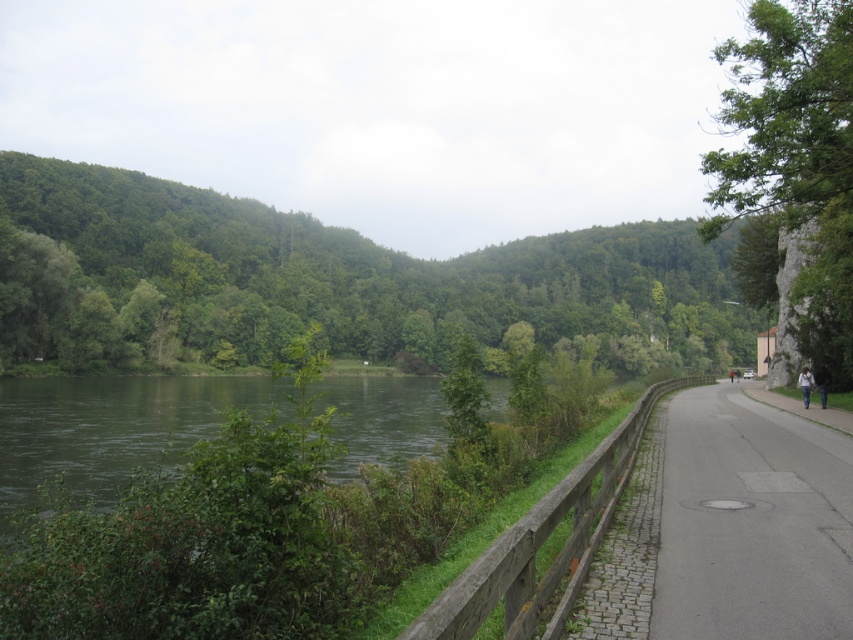
Can you confirm if green leafy tree at center is bigger than gray asphalt road at right?

Indeed, green leafy tree at center has a larger size compared to gray asphalt road at right.

Is point (288, 241) positioned behind point (762, 419)?

Yes.

This screenshot has height=640, width=853. I want to click on green leafy tree at center, so click(x=329, y=282).

Is point (38, 296) in front of point (125, 472)?

No, (38, 296) is behind (125, 472).

Does green leafy tree at center appear on the right side of green water at center?

Indeed, green leafy tree at center is positioned on the right side of green water at center.

Locate an element on the screen. The image size is (853, 640). green leafy tree at center is located at coordinates (329, 282).

Where is `green leafy tree at center`? The height and width of the screenshot is (640, 853). green leafy tree at center is located at coordinates (329, 282).

Does green water at center have a lesser height compared to wooden fence at center?

No.

Is green water at center thinner than wooden fence at center?

Incorrect, green water at center's width is not less than wooden fence at center's.

Where is `green water at center`? The height and width of the screenshot is (640, 853). green water at center is located at coordinates point(112,428).

Locate an element on the screen. green water at center is located at coordinates (112, 428).